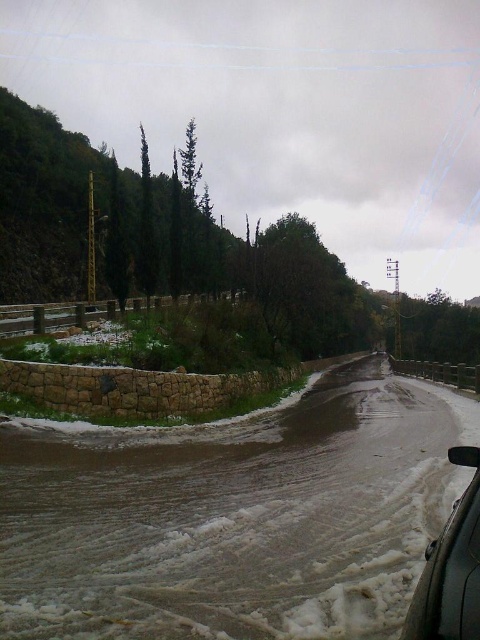
Question: Is brown stone wall at lower left positioned in front of sleek black car at lower right?

Choices:
 (A) no
 (B) yes

Answer: (A)

Question: Which object is farther from the camera taking this photo?

Choices:
 (A) sleek black car at lower right
 (B) brown stone wall at lower left

Answer: (B)

Question: Which object is closer to the camera taking this photo?

Choices:
 (A) brown stone wall at lower left
 (B) sleek black car at lower right

Answer: (B)

Question: Is brown stone wall at lower left smaller than sleek black car at lower right?

Choices:
 (A) no
 (B) yes

Answer: (A)

Question: In this image, where is brown stone wall at lower left located relative to sleek black car at lower right?

Choices:
 (A) above
 (B) below

Answer: (B)